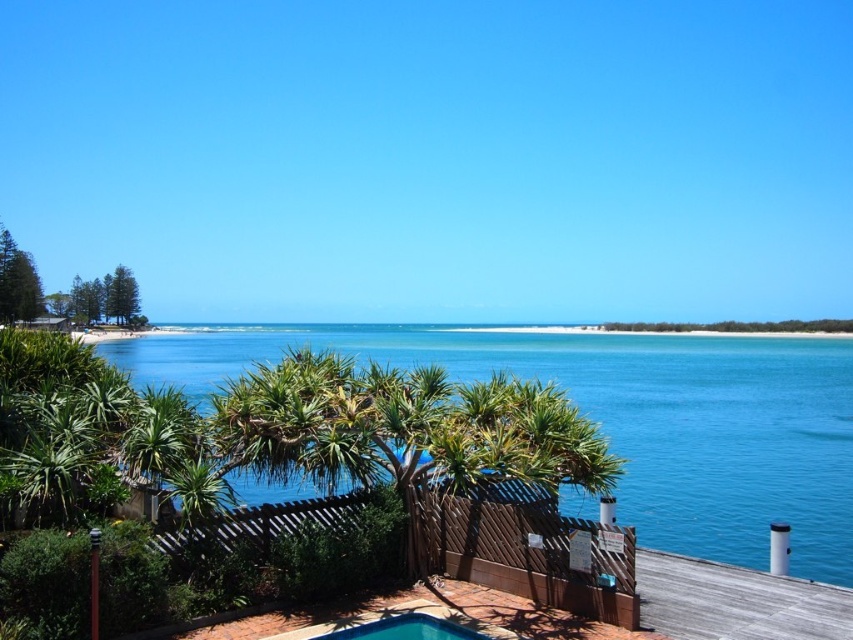
You are planning to swim and want to choose between the blue water at center and the blue glossy pool at lower center. Which one is larger in size?

The blue water at center is bigger than the blue glossy pool at lower center, so the blue water at center is larger in size.

You are standing at the wooden fence and want to walk to the blue water at center. Is the blue glossy pool at lower center in your path?

The blue glossy pool at lower center is at the edge of the paved area near the fence. Since the blue water at center is further out towards the horizon, you would need to walk around or past the pool to reach the water, so yes, the blue glossy pool at lower center is in your path.